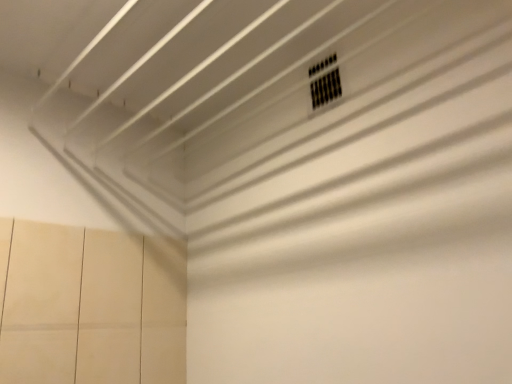
Describe the element at coordinates (325, 88) in the screenshot. I see `black plastic vent at upper center` at that location.

Identify the location of black plastic vent at upper center. (325, 88).

At what (x,y) coordinates should I click in order to perform the action: click on black plastic vent at upper center. Please return your answer as a coordinate pair (x, y). The width and height of the screenshot is (512, 384). Looking at the image, I should click on (325, 88).